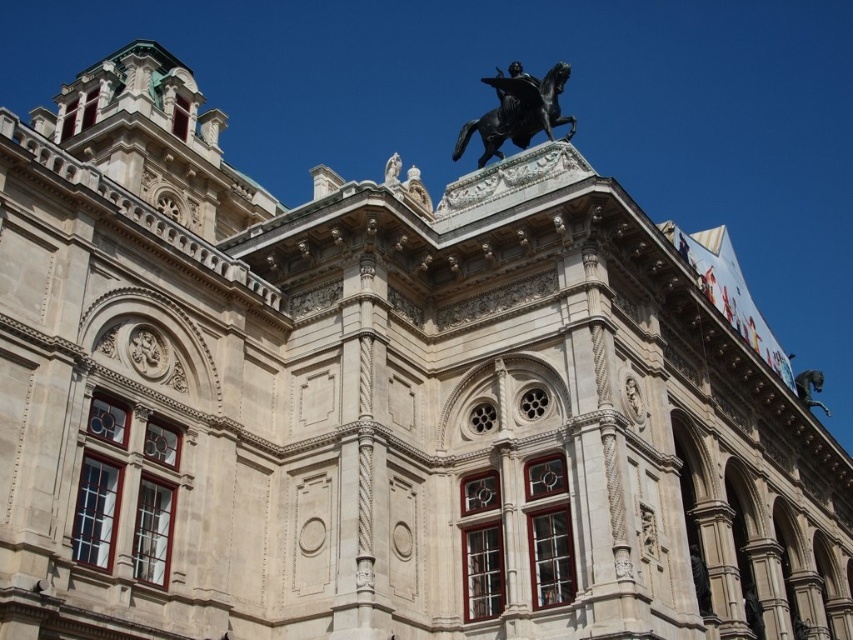
Can you confirm if black polished bronze horse at upper center is positioned below black metal horse at upper right?

Incorrect, black polished bronze horse at upper center is not positioned below black metal horse at upper right.

Between point (494, 148) and point (808, 403), which one is positioned in front?

Point (494, 148) is more forward.

Where is `black polished bronze horse at upper center`? The image size is (853, 640). black polished bronze horse at upper center is located at coordinates click(518, 112).